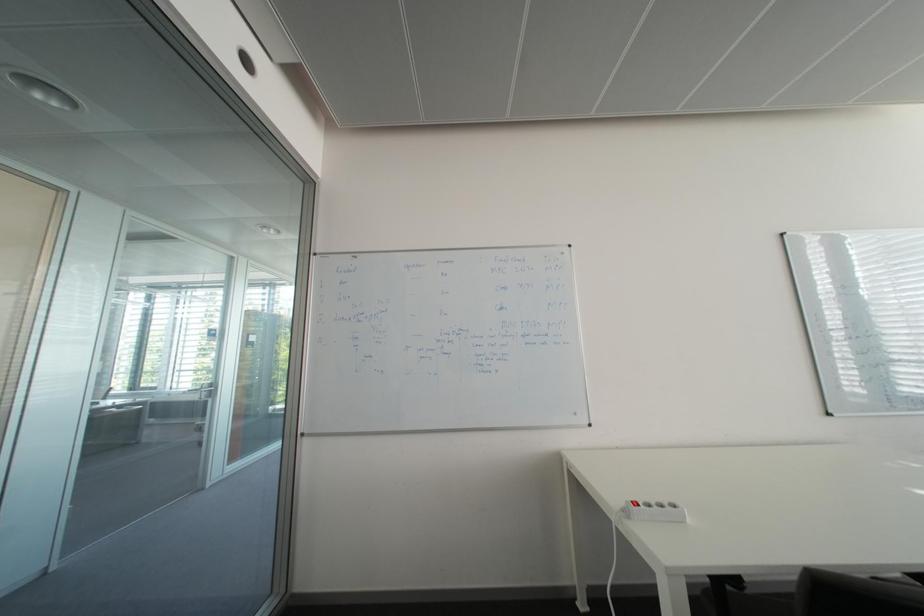
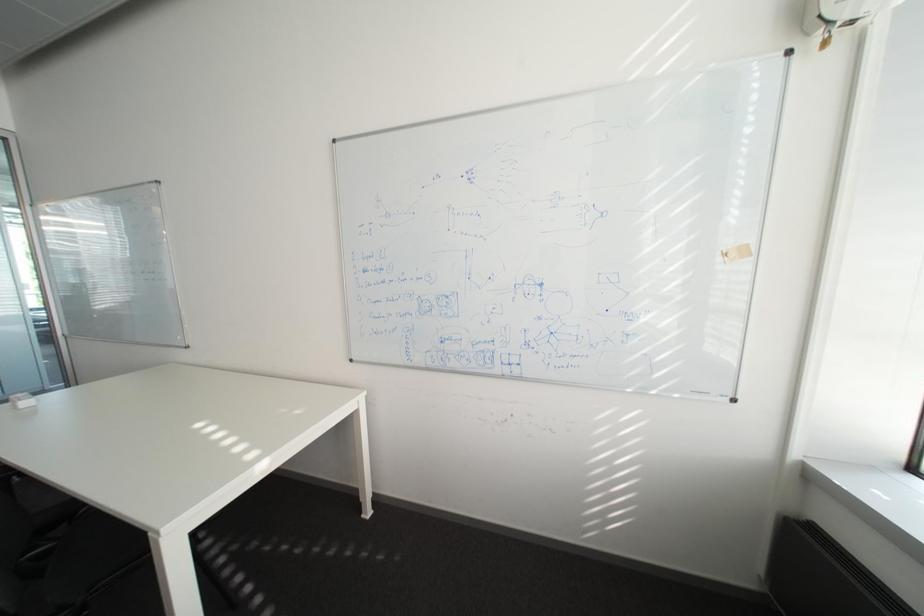
Question: In a continuous first-person perspective shot, in which direction is the camera moving?

Choices:
 (A) Left
 (B) Right
 (C) Forward
 (D) Backward

Answer: (B)